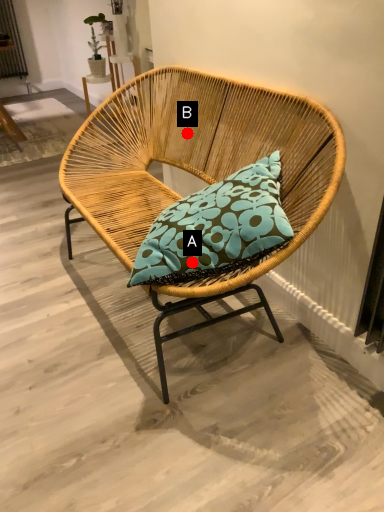
Question: Two points are circled on the image, labeled by A and B beside each circle. Among these points, which one is nearest to the camera?

Choices:
 (A) A is closer
 (B) B is closer

Answer: (A)